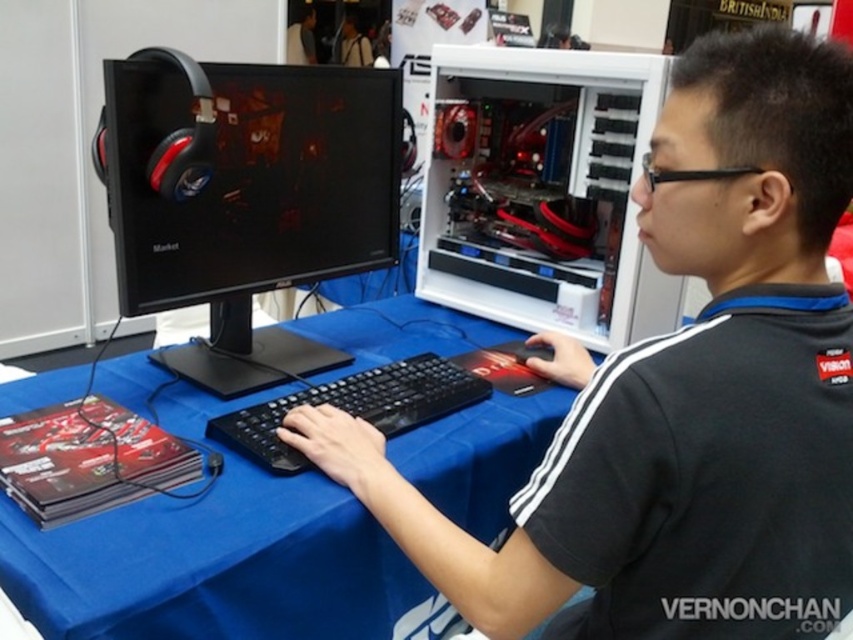
You need to place a new keyboard that is the same size as the black matte mouse at center on the table. Based on the scene, will the black plastic monitor at left block the keyboard from being placed directly to its right?

The black plastic monitor at left is bigger than the black matte mouse at center. Since the keyboard is the same size as the mouse, the monitor being larger may block the space to its right, making it difficult to place the keyboard there without adjusting the setup.